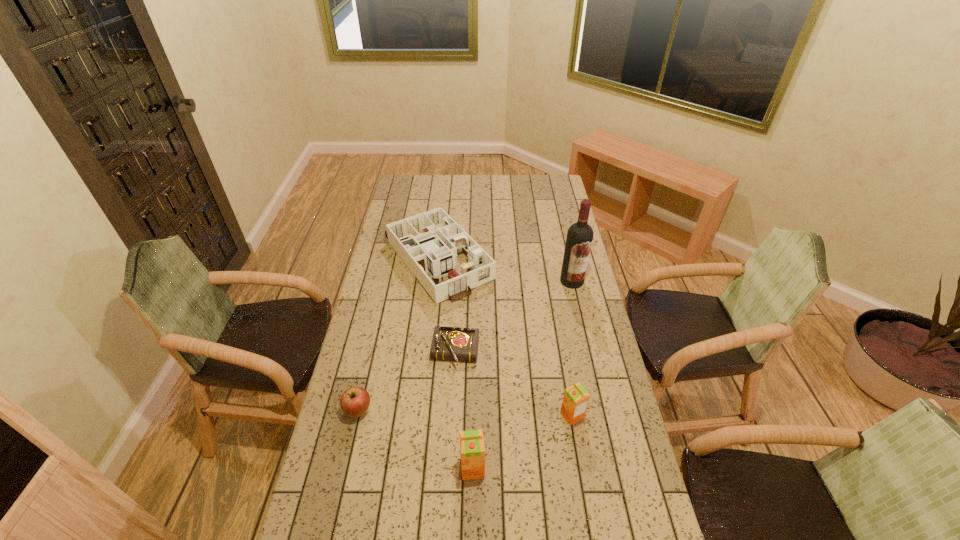
I want to click on vacant space that satisfies the following two spatial constraints: 1. on the front side of the dollhouse; 2. on the left side of the shortest object, so click(426, 353).